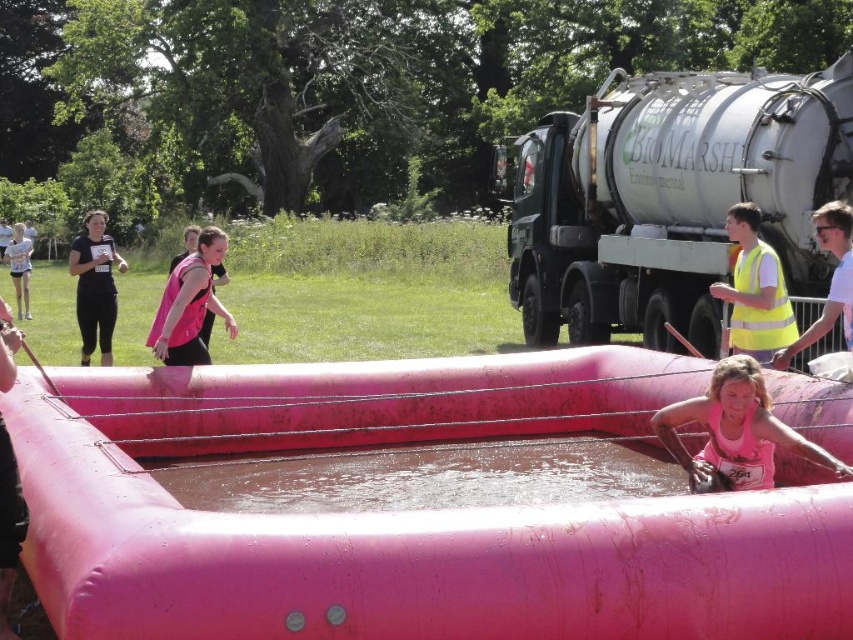
You are a participant in the mud run event and you see the point at coordinates (x=96, y=285). What object is this point located on?

The point at coordinates (x=96, y=285) is located on the matte black tank top at left.

You are a photographer at the mud run event. You need to take a photo that includes both the matte black tank top at left and yellow reflective vest at right. Considering their sizes, which one should you focus on to ensure both are clearly visible in the frame?

The matte black tank top at left is larger in size compared to the yellow reflective vest at right. To ensure both are clearly visible, focus on the matte black tank top at left as it will occupy more space in the frame, allowing the smaller yellow reflective vest at right to still be visible without overcrowding.